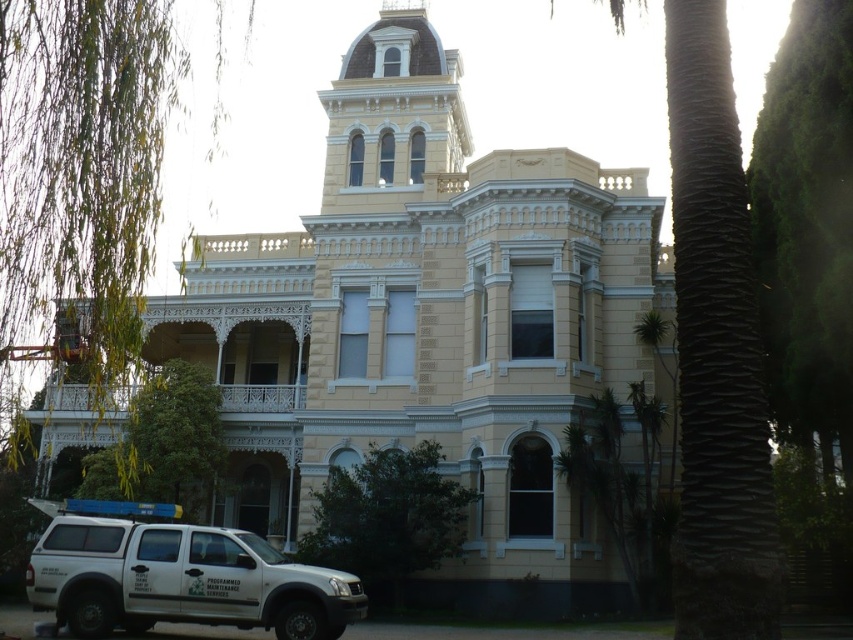
You are a photographer planning to capture the beige stone mansion at center and the white matte suv at lower left in a single frame. Given that the mansion is larger, would you position yourself closer to the mansion or the SUV to ensure both are visible in proportion?

Since the beige stone mansion at center is bigger than the white matte suv at lower left, you should position yourself closer to the SUV to balance their sizes in the photo. This way, the mansion won t appear too large compared to the SUV in the frame.

You are a delivery driver who just arrived at the beige stone mansion at center. Your vehicle, the white matte suv at lower left, has a height of 1.8 meters. The entrance to the mansion has a low archway that is 2 meters tall. Can your suv pass under the archway without hitting it?

The beige stone mansion at center is positioned over the white matte suv at lower left, which means the mansion is closer to the viewer. The entrance archway is part of the mansion structure. Since the archway is 2 meters tall and the suv is 1.8 meters tall, the suv can pass under the archway as it is shorter than the archway height.

From the picture: You are standing at the entrance of a park and see the beige stone mansion at center. If you want to take a photo of the entire building without any cropping, what should you do with your camera?

The beige stone mansion at center is 189.90 feet away from you, so you need to use a wide angle lens to capture the entire building in one frame.